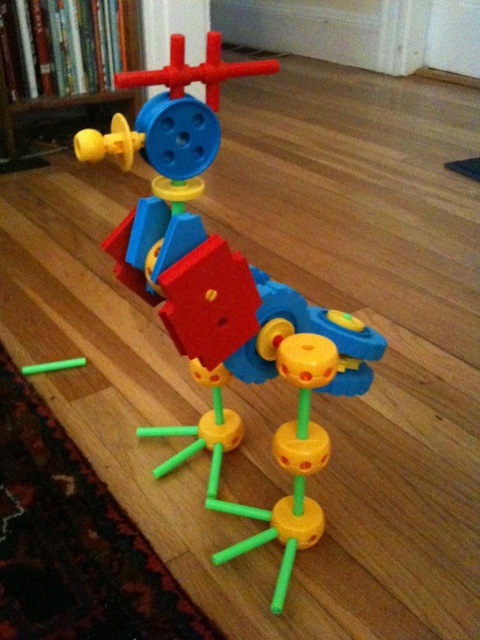
Who is taller, matte plastic toy at center or matte yellow plastic toy at upper left?

With more height is matte plastic toy at center.

This screenshot has height=640, width=480. Describe the element at coordinates (225, 298) in the screenshot. I see `matte plastic toy at center` at that location.

I want to click on matte plastic toy at center, so click(225, 298).